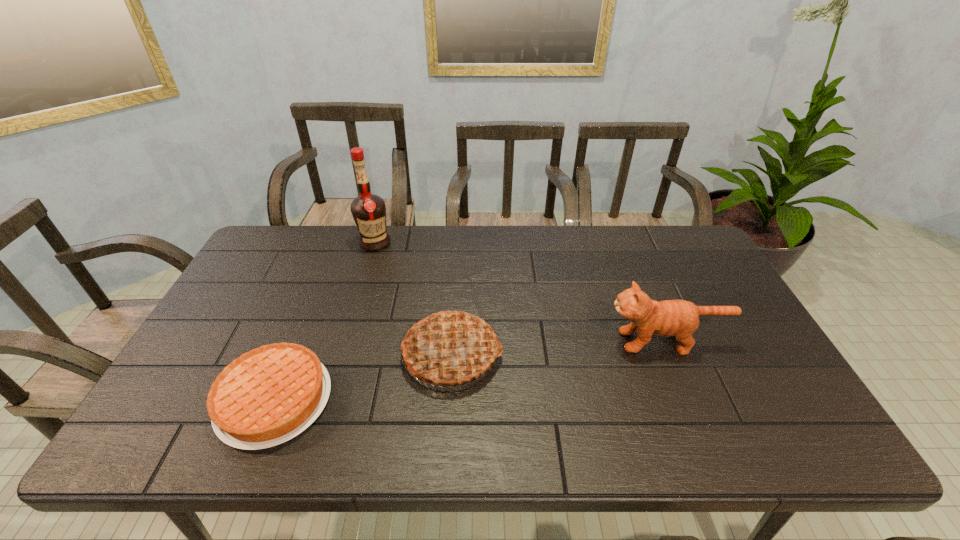
Identify the location of free space located on the face of the cat. The image size is (960, 540). (572, 341).

At what (x,y) coordinates should I click in order to perform the action: click on free point located 0.090m on the right of the right pie. Please return your answer as a coordinate pair (x, y). This screenshot has width=960, height=540. Looking at the image, I should click on (537, 355).

What are the coordinates of `free space located on the right of the shortest object` in the screenshot? It's located at (368, 400).

In order to click on object at the far edge in this screenshot , I will do (x=368, y=210).

The width and height of the screenshot is (960, 540). In order to click on object situated at the near edge in this screenshot , I will do `click(267, 396)`.

This screenshot has height=540, width=960. Identify the location of object that is at the left edge. (267, 396).

This screenshot has height=540, width=960. Find the location of `object located in the right edge section of the desktop`. object located in the right edge section of the desktop is located at coordinates (679, 318).

At what (x,y) coordinates should I click in order to perform the action: click on object that is positioned at the near left corner. Please return your answer as a coordinate pair (x, y). This screenshot has width=960, height=540. Looking at the image, I should click on (267, 396).

In the image, there is a desktop. In order to click on vacant space at the far edge in this screenshot , I will do `click(390, 265)`.

At what (x,y) coordinates should I click in order to perform the action: click on vacant space at the near edge of the desktop. Please return your answer as a coordinate pair (x, y). Looking at the image, I should click on (678, 437).